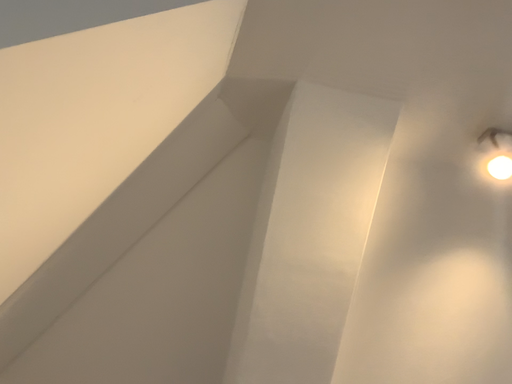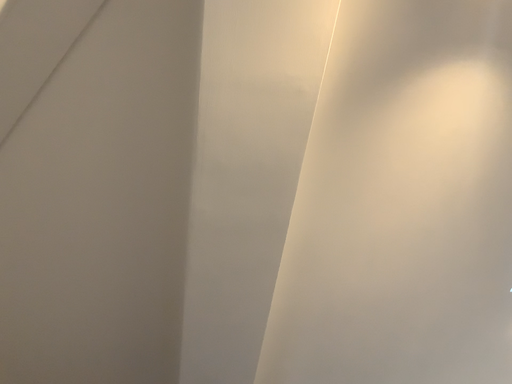
Question: Which way did the camera rotate in the video?

Choices:
 (A) rotated upward
 (B) rotated downward

Answer: (B)